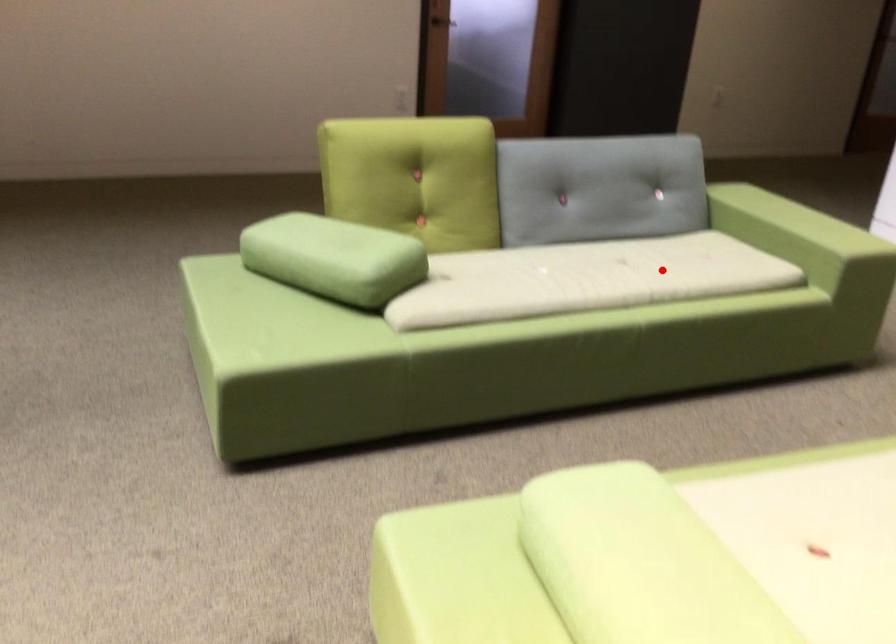
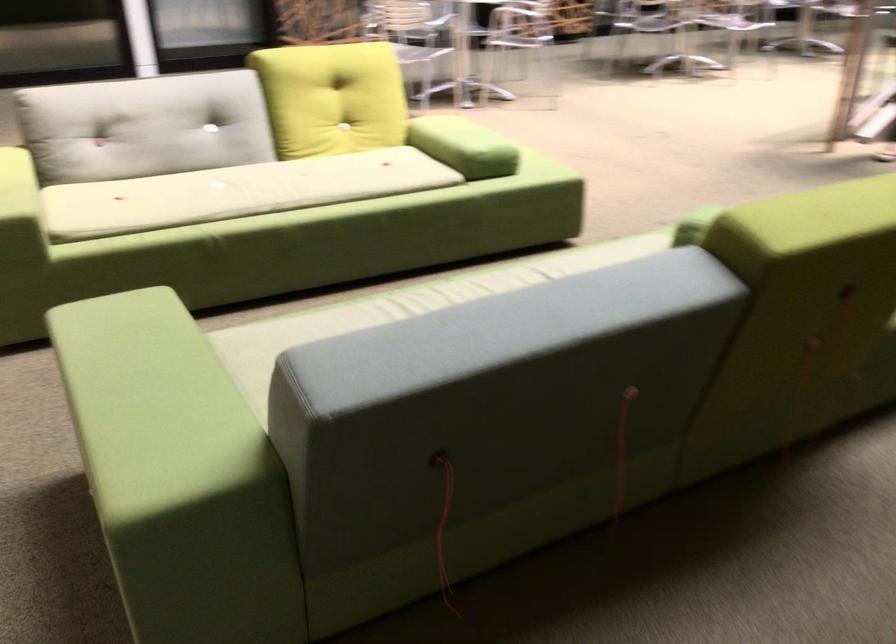
Question: A red point is marked in image1. In image2, is the corresponding 3D point closer to the camera or farther? Reply with the corresponding letter.

Choices:
 (A) The corresponding 3D point is closer.
 (B) The corresponding 3D point is farther.

Answer: (A)